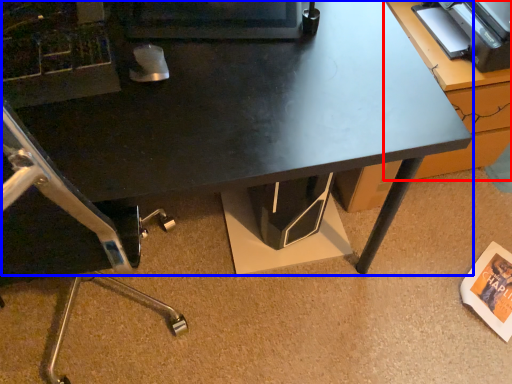
Question: Among these objects, which one is nearest to the camera, table (highlighted by a red box) or desk (highlighted by a blue box)?

Choices:
 (A) table
 (B) desk

Answer: (B)